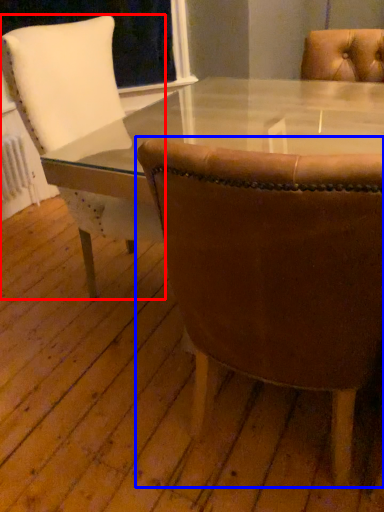
Question: Which of the following is the closest to the observer, chair (highlighted by a red box) or chair (highlighted by a blue box)?

Choices:
 (A) chair
 (B) chair

Answer: (B)